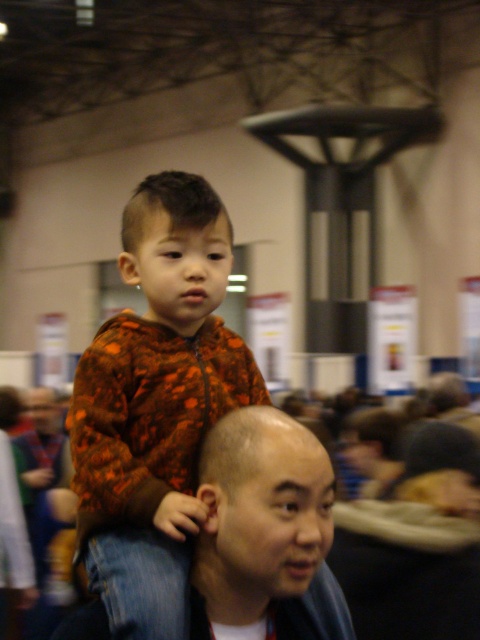
You are standing in the convention center and see two points marked in the image. Which point is closer to you, point (224, 257) or point (115, 362)?

Point (115, 362) is closer to you because the description states that point (224, 257) is further away from the viewer.

You are a photographer trying to capture a clear shot of both the orange printed hoodie at center and the orange fleece jacket at upper center. Which one will appear larger in your photo?

The orange printed hoodie at center will appear larger in the photo because it is closer to the viewer than the orange fleece jacket at upper center.

You are an event planner assessing the layout of the convention center. You notice the orange printed hoodie at center and the smooth brown hair at upper center. Which object is positioned higher in the image?

The orange printed hoodie at center is taller than the smooth brown hair at upper center, so the orange printed hoodie at center is positioned higher in the image.